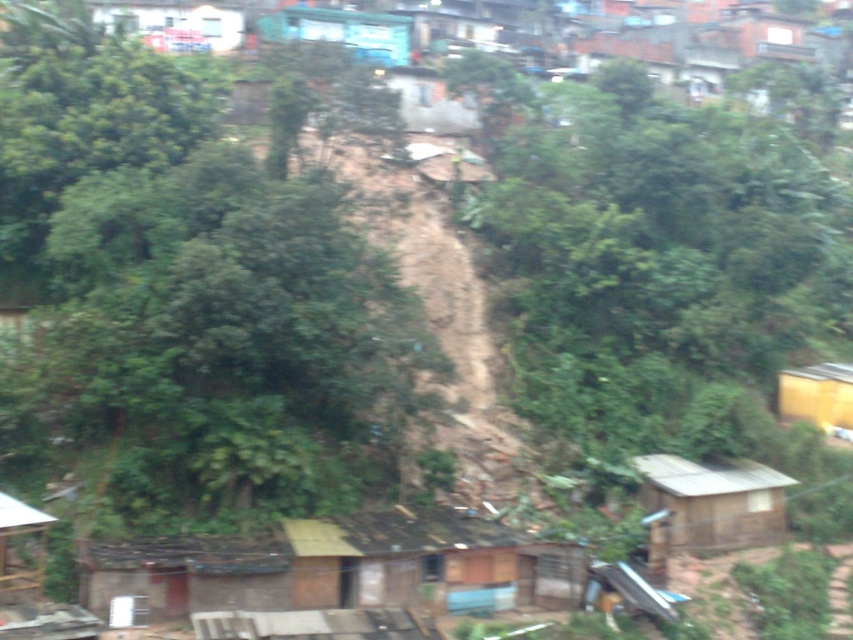
Who is higher up, brown corrugated metal hut at lower center or blue corrugated metal hut at upper center?

blue corrugated metal hut at upper center is above.

Does brown corrugated metal hut at lower center have a lesser height compared to blue corrugated metal hut at upper center?

Correct, brown corrugated metal hut at lower center is not as tall as blue corrugated metal hut at upper center.

Is point (209, 556) positioned behind point (300, 24)?

That is False.

Locate an element on the screen. brown corrugated metal hut at lower center is located at coordinates (341, 566).

Between green leafy tree at center and blue corrugated metal hut at upper center, which one has less height?

blue corrugated metal hut at upper center is shorter.

Does green leafy tree at center appear over blue corrugated metal hut at upper center?

No.

The image size is (853, 640). What do you see at coordinates (192, 288) in the screenshot? I see `green leafy tree at center` at bounding box center [192, 288].

Where is `green leafy tree at center`? The height and width of the screenshot is (640, 853). green leafy tree at center is located at coordinates (192, 288).

In the scene shown: Between brown wooden hut at lower right and wooden hut at lower left, which one is positioned higher?

wooden hut at lower left is above.

Between brown wooden hut at lower right and wooden hut at lower left, which one appears on the right side from the viewer's perspective?

brown wooden hut at lower right

Who is more forward, (741, 458) or (0, 582)?

Positioned in front is point (0, 582).

Where is `brown wooden hut at lower right`? The image size is (853, 640). brown wooden hut at lower right is located at coordinates (714, 500).